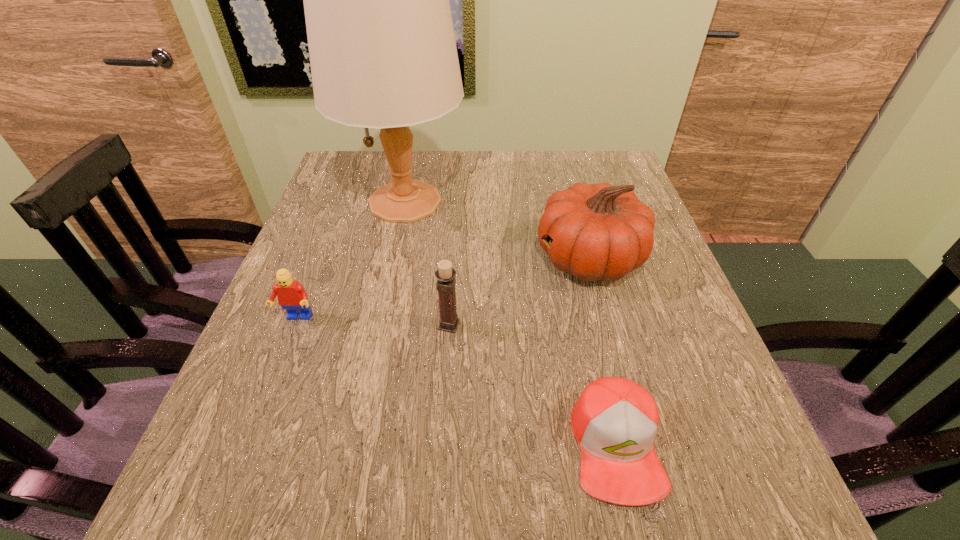
The image size is (960, 540). I want to click on vacant area that lies between the baseball cap and the third tallest object, so click(533, 385).

The height and width of the screenshot is (540, 960). I want to click on vacant region between the pumpkin and the third shortest object, so click(519, 292).

In order to click on empty location between the pumpkin and the tallest object in this screenshot , I will do point(497,230).

Find the location of a particular element. The height and width of the screenshot is (540, 960). free space between the nearest object and the pumpkin is located at coordinates (603, 352).

Where is `unoccupied position between the pumpkin and the tallest object`? Image resolution: width=960 pixels, height=540 pixels. unoccupied position between the pumpkin and the tallest object is located at coordinates (497, 230).

The width and height of the screenshot is (960, 540). Identify the location of vacant region between the third shortest object and the second shortest object. (372, 322).

Find the location of a particular element. This screenshot has height=540, width=960. the third closest object to the third shortest object is located at coordinates (383, 55).

This screenshot has height=540, width=960. I want to click on object that is the fourth closest one to the fourth tallest object, so click(x=615, y=421).

Where is `free space that satisfies the following two spatial constraints: 1. on the face of the pumpkin; 2. on the front-facing side of the shortest object`? Image resolution: width=960 pixels, height=540 pixels. free space that satisfies the following two spatial constraints: 1. on the face of the pumpkin; 2. on the front-facing side of the shortest object is located at coordinates (639, 445).

You are a GUI agent. You are given a task and a screenshot of the screen. Output one action in this format:
    pyautogui.click(x=<x>, y=<y>)
    Task: Click on the free region that satisfies the following two spatial constraints: 1. on the face of the pumpkin; 2. on the front-facing side of the second shortest object
    
    Given the screenshot: What is the action you would take?
    pyautogui.click(x=605, y=319)